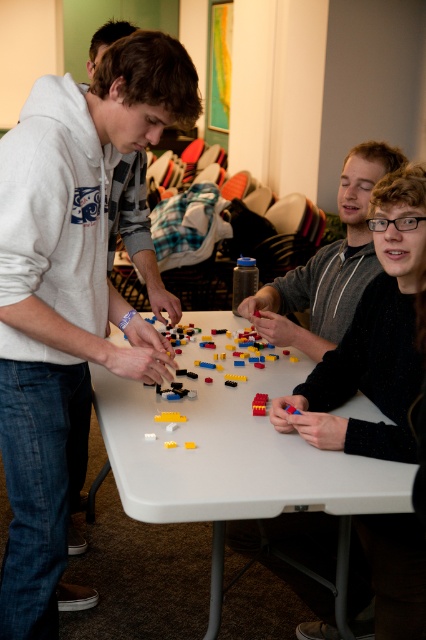
Question: Estimate the real-world distances between objects in this image. Which object is closer to the matte gray hoodie at left?

Choices:
 (A) translucent plastic lego pieces at center
 (B) white plastic table at center
 (C) matte gray sweater at center

Answer: (B)

Question: Which point is farther to the camera?

Choices:
 (A) (49, 145)
 (B) (178, 362)
 (C) (310, 308)
 (D) (279, 369)

Answer: (C)

Question: Considering the relative positions of matte gray hoodie at left and white plastic table at center in the image provided, where is matte gray hoodie at left located with respect to white plastic table at center?

Choices:
 (A) left
 (B) right

Answer: (A)

Question: Can you confirm if white plastic table at center is positioned to the left of brick red plastic blocks at center?

Choices:
 (A) no
 (B) yes

Answer: (B)

Question: Is white plastic table at center bigger than brick red plastic blocks at center?

Choices:
 (A) no
 (B) yes

Answer: (B)

Question: Which point is closer to the camera taking this photo?

Choices:
 (A) (155, 72)
 (B) (367, 147)
 (C) (264, 413)
 (D) (216, 369)

Answer: (A)